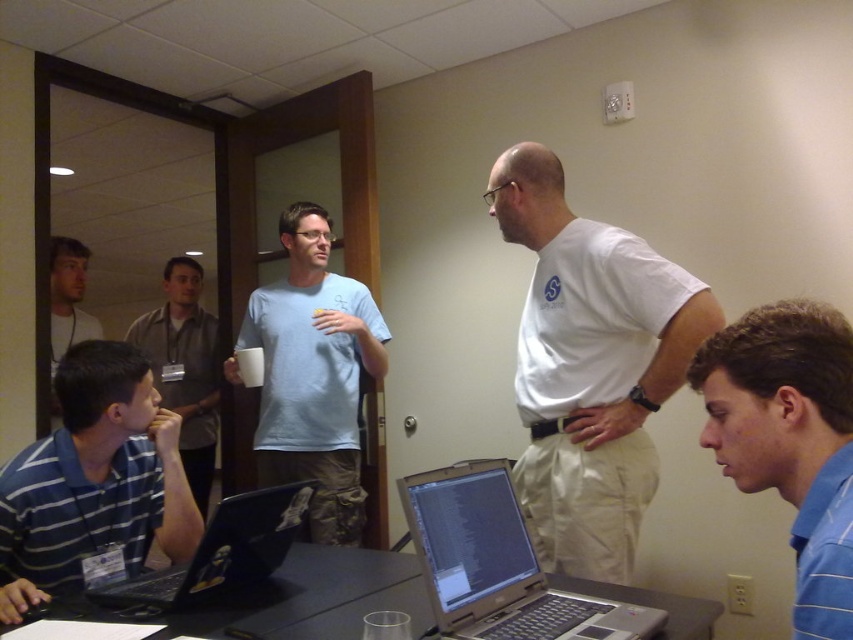
You are organizing a presentation and need to place a name tag on the table. The name tag must be placed between the blue striped shirt at lower right and the silver metallic laptop at center. Where exactly should you place it?

The name tag should be placed between the blue striped shirt at lower right and the silver metallic laptop at center, as the blue striped shirt at lower right is positioned on the right side of the silver metallic laptop at center.

In the scene, there are two people wearing gray shirts. The first is described as having a gray fabric shirt at left, and the second as a matte gray shirt at upper left. From the perspective of someone entering the room through the door behind the table, which gray shirt is closer to the door?

The gray fabric shirt at left is closer to the door than the matte gray shirt at upper left because it is positioned further to the left side of the scene, which would be near the entrance when entering from the door behind the table.

Based on the scene description, where is the blue striped shirt located in relation to the point marked at coordinates (x=790, y=440)?

The blue striped shirt at lower right is located at the point marked at coordinates (x=790, y=440).